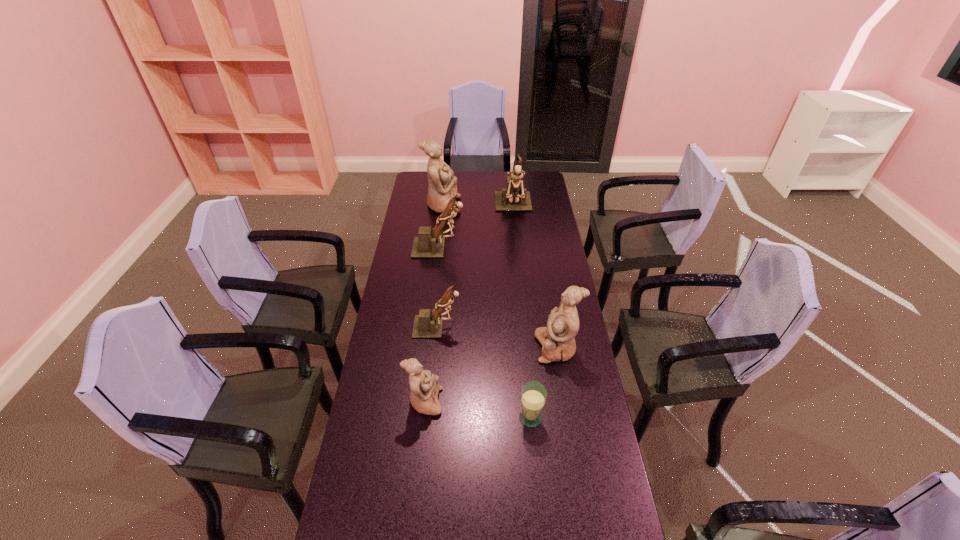
The width and height of the screenshot is (960, 540). I want to click on the biggest white figurine, so click(x=442, y=187).

At what (x,y) coordinates should I click in order to perform the action: click on the biggest brown figurine. Please return your answer as a coordinate pair (x, y). This screenshot has width=960, height=540. Looking at the image, I should click on click(512, 198).

You are a GUI agent. You are given a task and a screenshot of the screen. Output one action in this format:
    pyautogui.click(x=<x>, y=<y>)
    Task: Click on the rightmost brown figurine
    The width and height of the screenshot is (960, 540).
    Given the screenshot: What is the action you would take?
    pyautogui.click(x=512, y=198)

The height and width of the screenshot is (540, 960). Find the location of `the fifth nearest object`. the fifth nearest object is located at coordinates (427, 245).

The height and width of the screenshot is (540, 960). I want to click on the fourth nearest figurine, so click(427, 245).

Find the location of `the second smallest white figurine`. the second smallest white figurine is located at coordinates (557, 339).

What are the coordinates of `the second farthest white figurine` in the screenshot? It's located at click(x=557, y=339).

Where is `the nearest white figurine`? The image size is (960, 540). the nearest white figurine is located at coordinates (424, 385).

You are a GUI agent. You are given a task and a screenshot of the screen. Output one action in this format:
    pyautogui.click(x=<x>, y=<y>)
    Task: Click on the smallest white figurine
    This screenshot has height=540, width=960.
    Given the screenshot: What is the action you would take?
    pyautogui.click(x=424, y=385)

Locate an element on the screen. This screenshot has width=960, height=540. the nearest brown figurine is located at coordinates (428, 324).